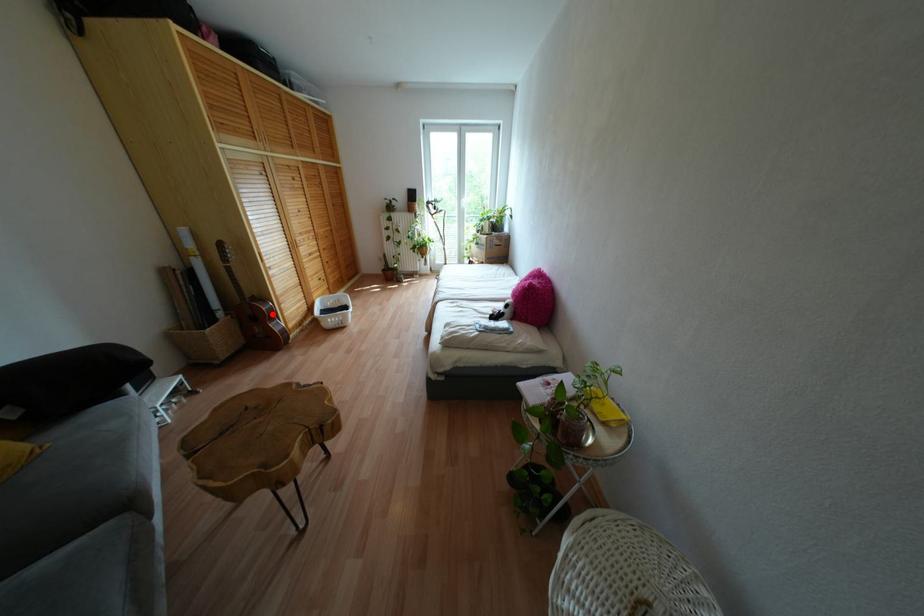
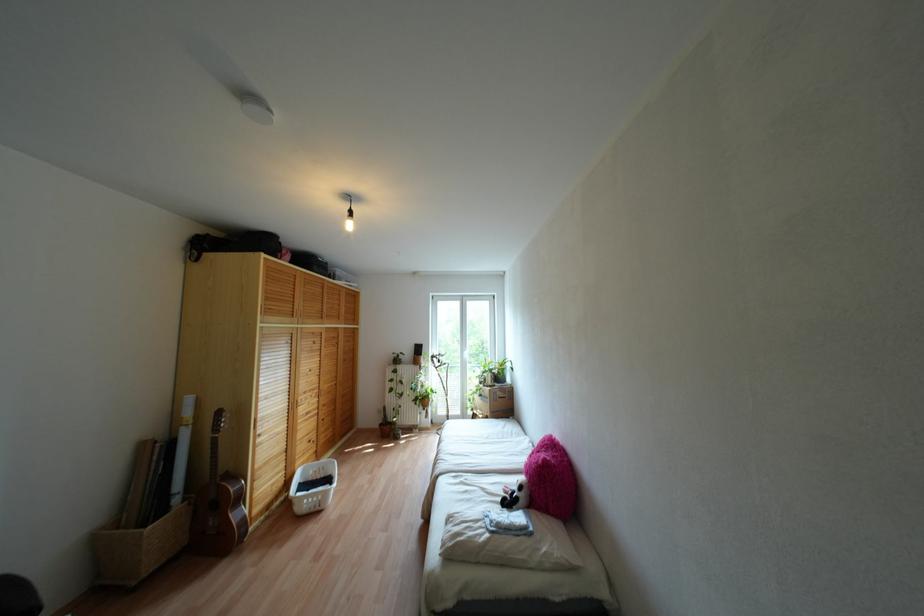
Question: I am providing you with two images of the same scene from different viewpoints. Given a red point in image1, look at the same physical point in image2. Is it:

Choices:
 (A) Closer to the viewpoint
 (B) Farther from the viewpoint

Answer: (B)